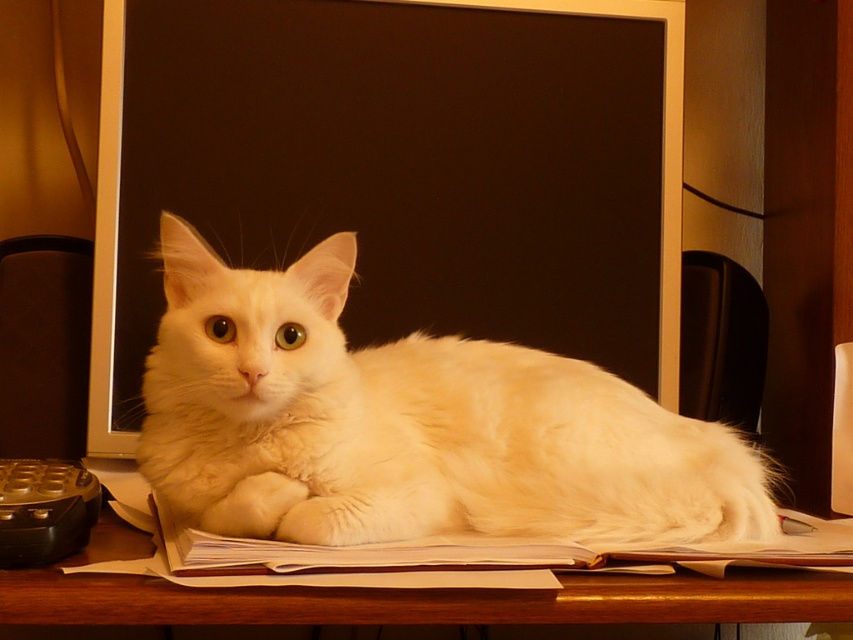
Question: Can you confirm if black matte computer screen at center is bigger than wooden table at lower center?

Choices:
 (A) no
 (B) yes

Answer: (B)

Question: Considering the real-world distances, which object is farthest from the wooden table at lower center?

Choices:
 (A) white fluffy cat at center
 (B) black matte computer screen at center

Answer: (B)

Question: Is black matte computer screen at center to the right of white fluffy cat at center from the viewer's perspective?

Choices:
 (A) yes
 (B) no

Answer: (B)

Question: Which point is farther from the camera taking this photo?

Choices:
 (A) (506, 504)
 (B) (838, 580)
 (C) (334, 17)

Answer: (C)

Question: Can you confirm if black matte computer screen at center is positioned to the right of wooden table at lower center?

Choices:
 (A) yes
 (B) no

Answer: (B)

Question: Which of the following is the closest to the observer?

Choices:
 (A) (171, 356)
 (B) (144, 592)

Answer: (B)